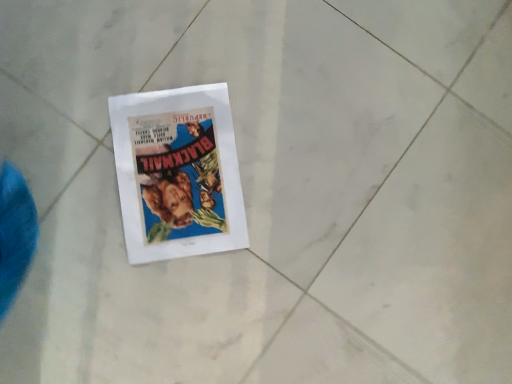
The height and width of the screenshot is (384, 512). I want to click on vacant space situated above matte paper poster at center (from a real-world perspective), so click(x=180, y=175).